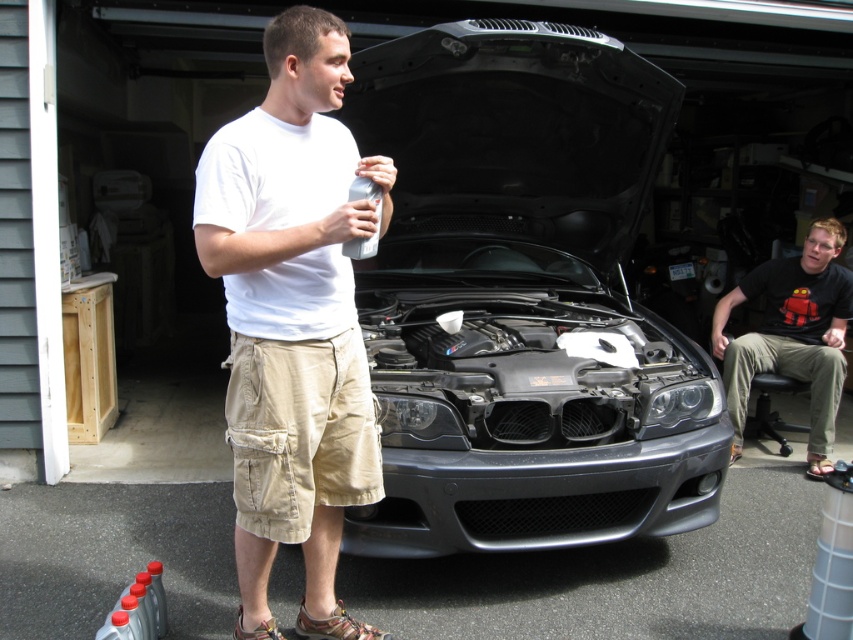
Does satin black car at center appear on the right side of black cotton shirt at right?

Incorrect, satin black car at center is not on the right side of black cotton shirt at right.

Between point (389, 104) and point (845, 236), which one is positioned in front?

Point (389, 104)

You are a GUI agent. You are given a task and a screenshot of the screen. Output one action in this format:
    pyautogui.click(x=<x>, y=<y>)
    Task: Click on the satin black car at center
    This screenshot has width=853, height=640.
    Given the screenshot: What is the action you would take?
    pyautogui.click(x=521, y=298)

Is white cotton t-shirt at center to the right of black cotton shirt at right from the viewer's perspective?

No, white cotton t-shirt at center is not to the right of black cotton shirt at right.

Who is lower down, white cotton t-shirt at center or black cotton shirt at right?

Positioned lower is black cotton shirt at right.

Which is behind, point (282, 410) or point (819, 458)?

Positioned behind is point (819, 458).

Where is `white cotton t-shirt at center`? This screenshot has width=853, height=640. white cotton t-shirt at center is located at coordinates (293, 317).

Between satin black car at center and white cotton t-shirt at center, which one is positioned lower?

white cotton t-shirt at center

Does satin black car at center appear under white cotton t-shirt at center?

No.

Is point (709, 406) in front of point (245, 218)?

No, it is behind (245, 218).

I want to click on satin black car at center, so click(521, 298).